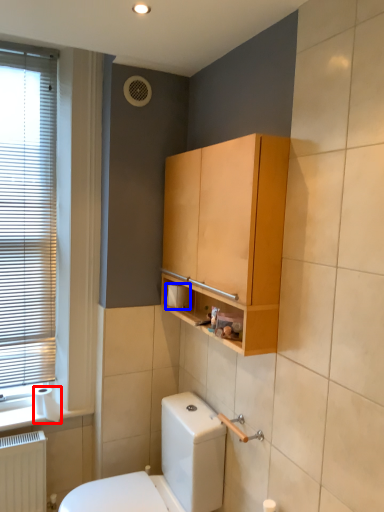
Question: Which of the following is the closest to the observer, toilet paper (highlighted by a red box) or toilet paper (highlighted by a blue box)?

Choices:
 (A) toilet paper
 (B) toilet paper

Answer: (B)